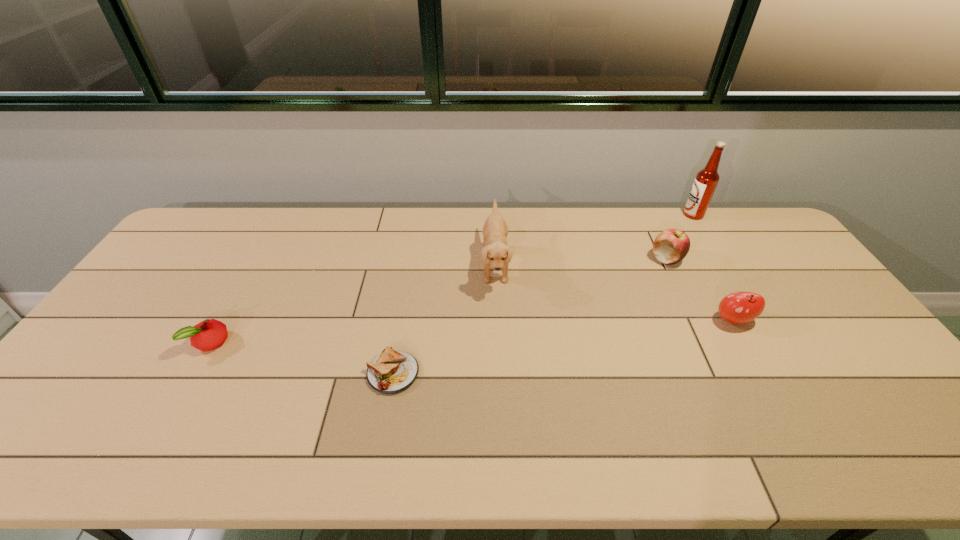
At what (x,y) coordinates should I click in order to perform the action: click on apple present at the far edge. Please return your answer as a coordinate pair (x, y). The width and height of the screenshot is (960, 540). Looking at the image, I should click on (671, 246).

In the image, there is a desktop. Where is `free region at the far edge`? This screenshot has height=540, width=960. free region at the far edge is located at coordinates [x=276, y=230].

The image size is (960, 540). I want to click on free space at the near edge, so click(635, 449).

Image resolution: width=960 pixels, height=540 pixels. I want to click on vacant space at the left edge of the desktop, so click(166, 265).

Image resolution: width=960 pixels, height=540 pixels. Find the location of `vacant space at the right edge`. vacant space at the right edge is located at coordinates (835, 315).

You are a GUI agent. You are given a task and a screenshot of the screen. Output one action in this format:
    pyautogui.click(x=<x>, y=<y>)
    Task: Click on the vacant region at the far left corner
    The image size is (960, 540).
    Given the screenshot: What is the action you would take?
    pyautogui.click(x=213, y=214)

Identify the location of vacant space in between the farthest apple and the sandwich. (530, 316).

The height and width of the screenshot is (540, 960). Find the location of `vacant space that is in between the fifth object from right to left and the leftmost apple`. vacant space that is in between the fifth object from right to left and the leftmost apple is located at coordinates [301, 358].

Find the location of `vacant space that is in between the fifth tallest object and the farthest apple`. vacant space that is in between the fifth tallest object and the farthest apple is located at coordinates (439, 301).

Identify the location of free space between the farthest apple and the fifth object from right to left. (530, 316).